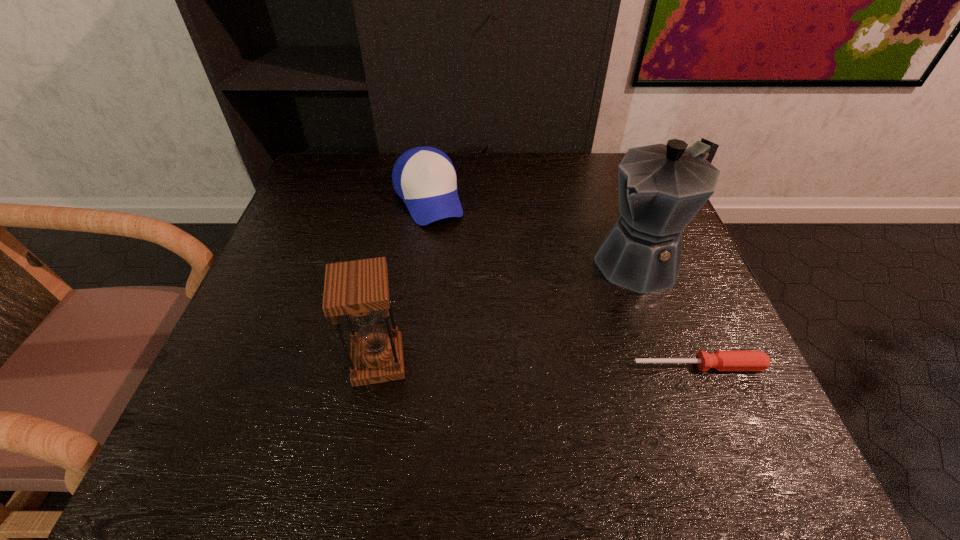
What are the coordinates of `free space located at the spout of the coffeepot` in the screenshot? It's located at (488, 367).

Find the location of a particular element. This screenshot has width=960, height=540. free location located 0.130m at the spout of the coffeepot is located at coordinates (568, 310).

Where is `vacant space positioned 0.240m at the spout of the coffeepot`? The height and width of the screenshot is (540, 960). vacant space positioned 0.240m at the spout of the coffeepot is located at coordinates tap(528, 339).

The height and width of the screenshot is (540, 960). Find the location of `object located in the far edge section of the desktop`. object located in the far edge section of the desktop is located at coordinates (424, 177).

Locate an element on the screen. This screenshot has width=960, height=540. hourglass that is at the near edge is located at coordinates (359, 289).

The height and width of the screenshot is (540, 960). What are the coordinates of `screwdriver positioned at the near edge` in the screenshot? It's located at tap(720, 360).

Locate an element on the screen. screwdriver positioned at the right edge is located at coordinates (720, 360).

Locate an element on the screen. This screenshot has height=540, width=960. coffeepot present at the right edge is located at coordinates (x=662, y=187).

The width and height of the screenshot is (960, 540). I want to click on object at the near right corner, so click(x=720, y=360).

Find the location of a particular element. Image resolution: width=960 pixels, height=540 pixels. free location at the far edge of the desktop is located at coordinates (468, 186).